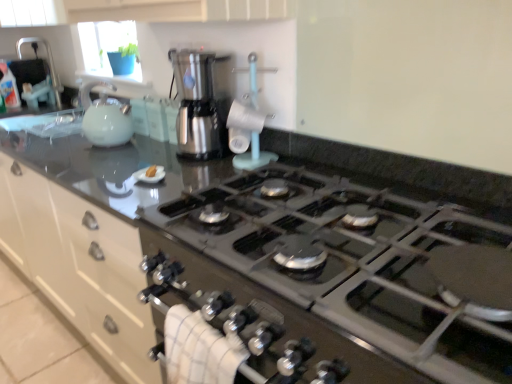
You are a GUI agent. You are given a task and a screenshot of the screen. Output one action in this format:
    pyautogui.click(x=<x>, y=<y>)
    Task: Click on the brushed metal sink at upper left
    This screenshot has height=384, width=512.
    Given the screenshot: What is the action you would take?
    pyautogui.click(x=47, y=126)

The width and height of the screenshot is (512, 384). What do you see at coordinates (198, 105) in the screenshot? I see `stainless steel coffee maker at center, arranged as the second kitchen appliance when viewed from the left` at bounding box center [198, 105].

Where is `white glossy cabinet at upper center`? white glossy cabinet at upper center is located at coordinates (155, 118).

Based on their sizes in the image, would you say brushed metal sink at upper left is bigger or smaller than matte white kettle at left, the first kitchen appliance when ordered from left to right?

brushed metal sink at upper left is bigger than matte white kettle at left, the first kitchen appliance when ordered from left to right.

From the image's perspective, between brushed metal sink at upper left and matte white kettle at left, the 2th kitchen appliance from the right, which one is located above?

brushed metal sink at upper left.

From a real-world perspective, which is physically below, brushed metal sink at upper left or matte white kettle at left, the 2th kitchen appliance from the right?

matte white kettle at left, the 2th kitchen appliance from the right, from a real-world perspective.

Identify the location of the 1st kitchen appliance in front of the brushed metal sink at upper left. (105, 118).

Based on the photo, how distant is white glossy cabinet at upper center from yellow sponge at center?

white glossy cabinet at upper center is 14.22 inches from yellow sponge at center.

From a real-world perspective, is white glossy cabinet at upper center physically located above or below yellow sponge at center?

In terms of real-world spatial position, white glossy cabinet at upper center is above yellow sponge at center.

From the picture: Does white glossy cabinet at upper center have a greater height compared to yellow sponge at center?

Correct, white glossy cabinet at upper center is much taller as yellow sponge at center.

Does point (163, 117) lie in front of point (145, 172)?

No, (163, 117) is further to viewer.

From a real-world perspective, which object rests below the other?

white glossy cabinet at upper center is physically lower.

From the image's perspective, is white glossy cabinet at upper center above or below stainless steel coffee maker at center, which ranks as the 1th kitchen appliance in right-to-left order?

From the image's perspective, white glossy cabinet at upper center appears above stainless steel coffee maker at center, which ranks as the 1th kitchen appliance in right-to-left order.

Does white glossy cabinet at upper center have a lesser height compared to stainless steel coffee maker at center, which ranks as the 1th kitchen appliance in right-to-left order?

Correct, white glossy cabinet at upper center is not as tall as stainless steel coffee maker at center, which ranks as the 1th kitchen appliance in right-to-left order.

Is white glossy cabinet at upper center to the left or to the right of stainless steel coffee maker at center, arranged as the second kitchen appliance when viewed from the left, in the image?

From the image, it's evident that white glossy cabinet at upper center is to the left of stainless steel coffee maker at center, arranged as the second kitchen appliance when viewed from the left.

Is black glass stove at center in front of or behind brushed metal sink at upper left in the image?

black glass stove at center is positioned closer to the viewer than brushed metal sink at upper left.

Is the surface of black glass stove at center in direct contact with brushed metal sink at upper left?

They are not placed beside each other.

From a real-world perspective, is black glass stove at center positioned over brushed metal sink at upper left based on gravity?

No, from a real-world perspective, black glass stove at center is not above brushed metal sink at upper left.

Between black glass stove at center and brushed metal sink at upper left, which one has more height?

brushed metal sink at upper left.

Is matte white kettle at left, the first kitchen appliance when ordered from left to right, not within stainless steel coffee maker at center, arranged as the second kitchen appliance when viewed from the left?

Absolutely, matte white kettle at left, the first kitchen appliance when ordered from left to right, is external to stainless steel coffee maker at center, arranged as the second kitchen appliance when viewed from the left.

Is matte white kettle at left, the first kitchen appliance when ordered from left to right, at the right side of stainless steel coffee maker at center, which ranks as the 1th kitchen appliance in right-to-left order?

No.

From a real-world perspective, which object rests below the other?

matte white kettle at left, the first kitchen appliance when ordered from left to right, from a real-world perspective.

Is brushed metal sink at upper left facing away from stainless steel coffee maker at center, arranged as the second kitchen appliance when viewed from the left?

That's not correct — brushed metal sink at upper left is not looking away from stainless steel coffee maker at center, arranged as the second kitchen appliance when viewed from the left.

From the image's perspective, which is below, brushed metal sink at upper left or stainless steel coffee maker at center, arranged as the second kitchen appliance when viewed from the left?

stainless steel coffee maker at center, arranged as the second kitchen appliance when viewed from the left, is shown below in the image.

Does brushed metal sink at upper left lie in front of stainless steel coffee maker at center, which ranks as the 1th kitchen appliance in right-to-left order?

No, the depth of brushed metal sink at upper left is greater than that of stainless steel coffee maker at center, which ranks as the 1th kitchen appliance in right-to-left order.

Does brushed metal sink at upper left have a greater height compared to stainless steel coffee maker at center, arranged as the second kitchen appliance when viewed from the left?

Correct, brushed metal sink at upper left is much taller as stainless steel coffee maker at center, arranged as the second kitchen appliance when viewed from the left.

From the image's perspective, is black glass stove at center located above or below stainless steel coffee maker at center, which ranks as the 1th kitchen appliance in right-to-left order?

black glass stove at center is below stainless steel coffee maker at center, which ranks as the 1th kitchen appliance in right-to-left order.

Looking at this image, which is more to the left, black glass stove at center or stainless steel coffee maker at center, which ranks as the 1th kitchen appliance in right-to-left order?

From the viewer's perspective, stainless steel coffee maker at center, which ranks as the 1th kitchen appliance in right-to-left order, appears more on the left side.

Considering the sizes of black glass stove at center and stainless steel coffee maker at center, which ranks as the 1th kitchen appliance in right-to-left order, in the image, is black glass stove at center wider or thinner than stainless steel coffee maker at center, which ranks as the 1th kitchen appliance in right-to-left order,?

black glass stove at center is wider than stainless steel coffee maker at center, which ranks as the 1th kitchen appliance in right-to-left order.

You are a GUI agent. You are given a task and a screenshot of the screen. Output one action in this format:
    pyautogui.click(x=<x>, y=<y>)
    Task: Click on the 1st kitchen appliance below the brushed metal sink at upper left (from the image's perspective)
    The width and height of the screenshot is (512, 384).
    Given the screenshot: What is the action you would take?
    pyautogui.click(x=105, y=118)

Locate an element on the screen. The image size is (512, 384). cabinetry located above the yellow sponge at center (from a real-world perspective) is located at coordinates click(155, 118).

Which object lies nearer to the anchor point matte white kettle at left, the 2th kitchen appliance from the right, black glass stove at center or stainless steel coffee maker at center, arranged as the second kitchen appliance when viewed from the left?

stainless steel coffee maker at center, arranged as the second kitchen appliance when viewed from the left, is closer to matte white kettle at left, the 2th kitchen appliance from the right.

When comparing their distances from stainless steel coffee maker at center, arranged as the second kitchen appliance when viewed from the left, does brushed metal sink at upper left or matte white kettle at left, the first kitchen appliance when ordered from left to right, seem further?

brushed metal sink at upper left is further to stainless steel coffee maker at center, arranged as the second kitchen appliance when viewed from the left.

Based on their spatial positions, is white glossy cabinet at upper center or black glass stove at center further from matte white kettle at left, the 2th kitchen appliance from the right?

black glass stove at center.

From the image, which object appears to be farther from matte white kettle at left, the 2th kitchen appliance from the right, yellow sponge at center or white glossy cabinet at upper center?

The object further to matte white kettle at left, the 2th kitchen appliance from the right, is yellow sponge at center.

When comparing their distances from white glossy cabinet at upper center, does brushed metal sink at upper left or matte white kettle at left, the 2th kitchen appliance from the right, seem closer?

matte white kettle at left, the 2th kitchen appliance from the right, is closer to white glossy cabinet at upper center.

Looking at the image, which one is located further to white glossy cabinet at upper center, yellow sponge at center or stainless steel coffee maker at center, arranged as the second kitchen appliance when viewed from the left?

Among the two, yellow sponge at center is located further to white glossy cabinet at upper center.

From the image, which object appears to be nearer to stainless steel coffee maker at center, which ranks as the 1th kitchen appliance in right-to-left order, brushed metal sink at upper left or white glossy cabinet at upper center?

white glossy cabinet at upper center is closer to stainless steel coffee maker at center, which ranks as the 1th kitchen appliance in right-to-left order.

From the image, which object appears to be nearer to stainless steel coffee maker at center, which ranks as the 1th kitchen appliance in right-to-left order, yellow sponge at center or black glass stove at center?

yellow sponge at center.

Locate an element on the screen. This screenshot has height=384, width=512. cabinetry between brushed metal sink at upper left and yellow sponge at center from left to right is located at coordinates (155, 118).

The image size is (512, 384). Find the location of `food positioned between black glass stove at center and white glossy cabinet at upper center from near to far`. food positioned between black glass stove at center and white glossy cabinet at upper center from near to far is located at coordinates (151, 171).

Identify the location of cabinetry between brushed metal sink at upper left and stainless steel coffee maker at center, arranged as the second kitchen appliance when viewed from the left. (155, 118).

Where is `food between black glass stove at center and matte white kettle at left, the 2th kitchen appliance from the right, along the z-axis`? The width and height of the screenshot is (512, 384). food between black glass stove at center and matte white kettle at left, the 2th kitchen appliance from the right, along the z-axis is located at coordinates (151, 171).